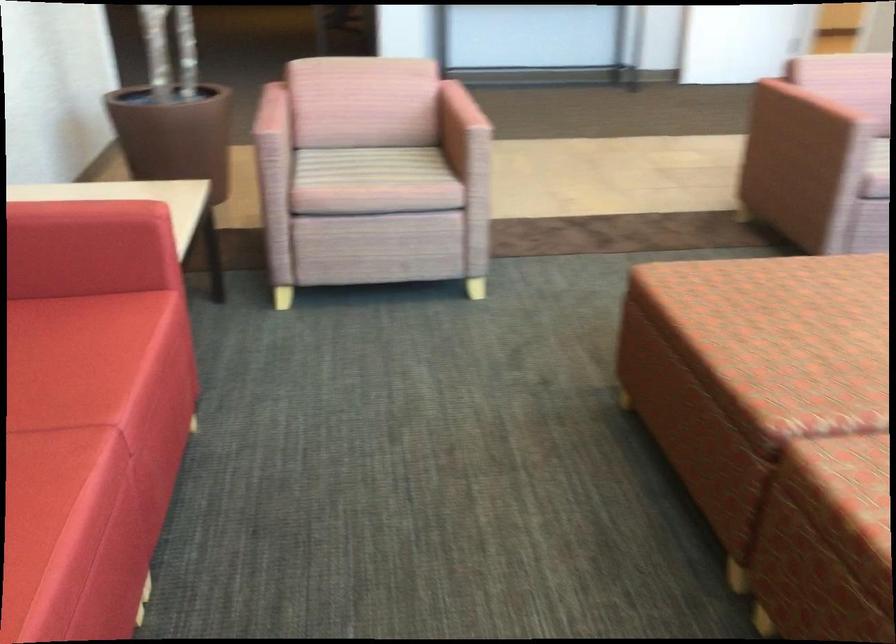
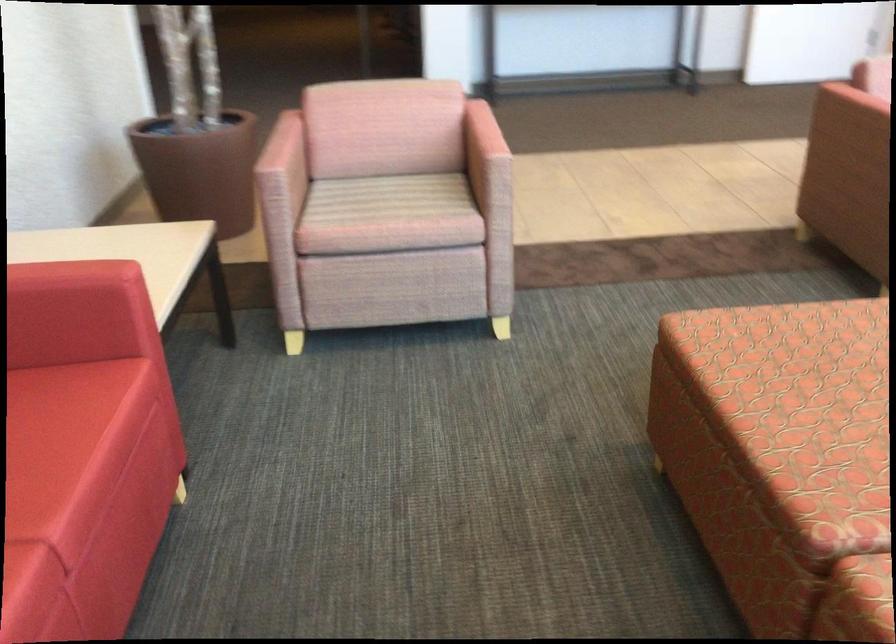
Where in the second image is the point corresponding to (280,138) from the first image?

(280, 176)